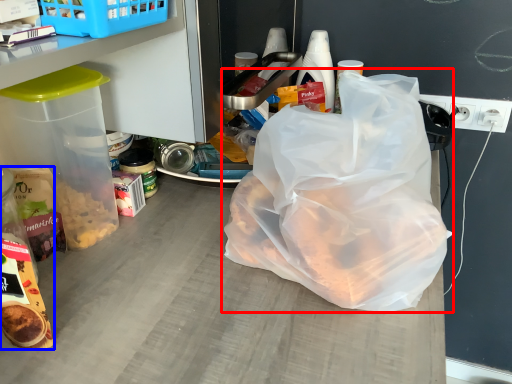
Question: Which of the following is the farthest to the observer, plastic bag (highlighted by a red box) or snack (highlighted by a blue box)?

Choices:
 (A) plastic bag
 (B) snack

Answer: (B)